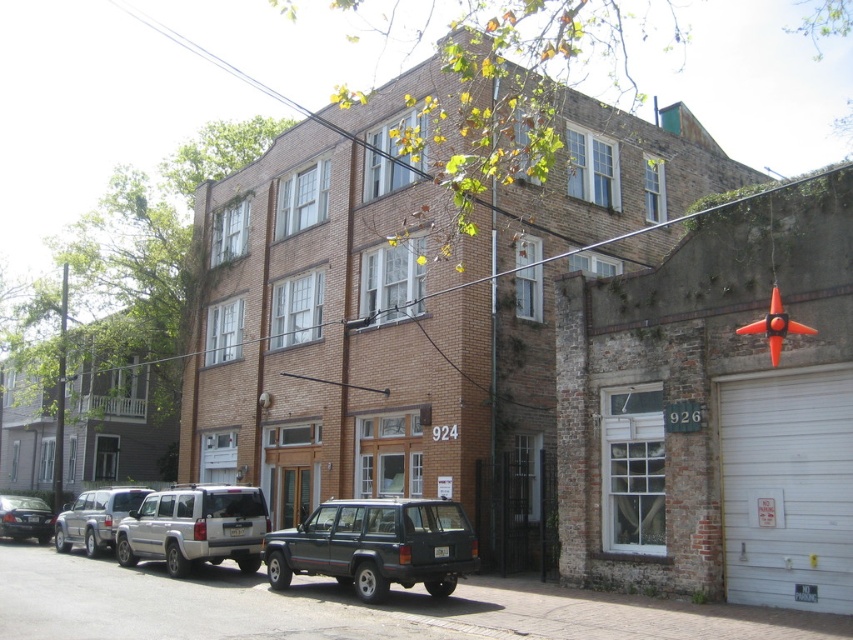
Question: Which of the following is the farthest from the observer?

Choices:
 (A) (107, 500)
 (B) (465, 525)

Answer: (A)

Question: Does silver metallic suv at center have a smaller size compared to matte black sedan at lower left?

Choices:
 (A) no
 (B) yes

Answer: (A)

Question: Does silver metallic suv at lower left have a greater width compared to matte black sedan at lower left?

Choices:
 (A) no
 (B) yes

Answer: (A)

Question: Where is silver metallic suv at lower left located in relation to silver metallic suv at center in the image?

Choices:
 (A) above
 (B) below

Answer: (A)

Question: Among these points, which one is farthest from the camera?

Choices:
 (A) (6, 499)
 (B) (137, 496)
 (C) (463, 541)
 (D) (149, 541)

Answer: (A)

Question: Which point appears closest to the camera in this image?

Choices:
 (A) (433, 563)
 (B) (84, 518)
 (C) (263, 512)
 (D) (10, 496)

Answer: (A)